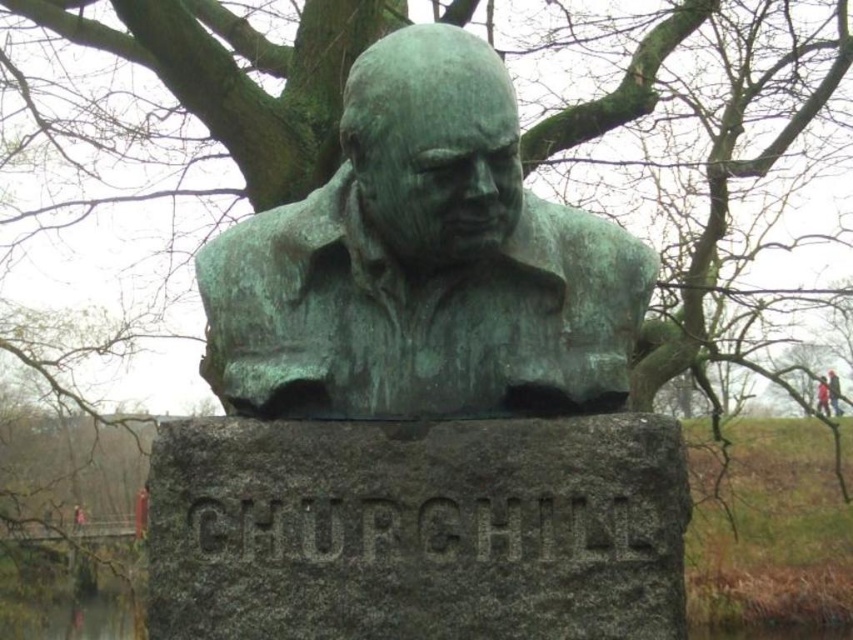
Is green patina bust at center taller than red fabric person at upper right?

Indeed, green patina bust at center has a greater height compared to red fabric person at upper right.

Is point (374, 376) farther from camera compared to point (820, 390)?

No, (374, 376) is in front of (820, 390).

Identify the location of green patina bust at center. The image size is (853, 640). (422, 262).